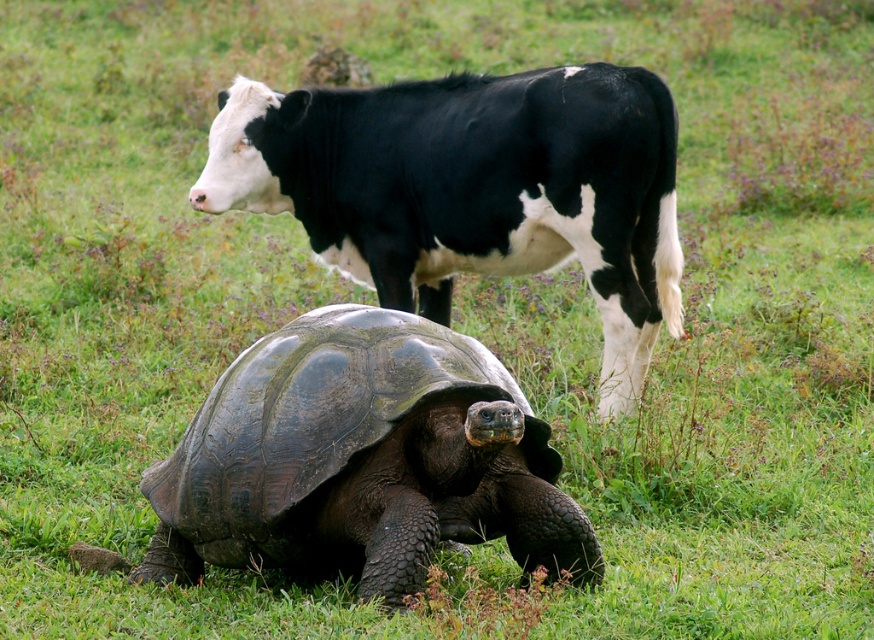
You are standing at point (327, 362) and want to walk to the cow in the background. Which direction should you move relative to point (424, 291)?

To reach the cow in the background, you should move towards point (424, 291) because it is behind point (327, 362), meaning the cow is in that direction.

You are standing in the grassy field and see both the shiny dark brown tortoise at center and the dark brown scaly tortoise at center. Which one is positioned to the right side?

The shiny dark brown tortoise at center is positioned to the right of the dark brown scaly tortoise at center.